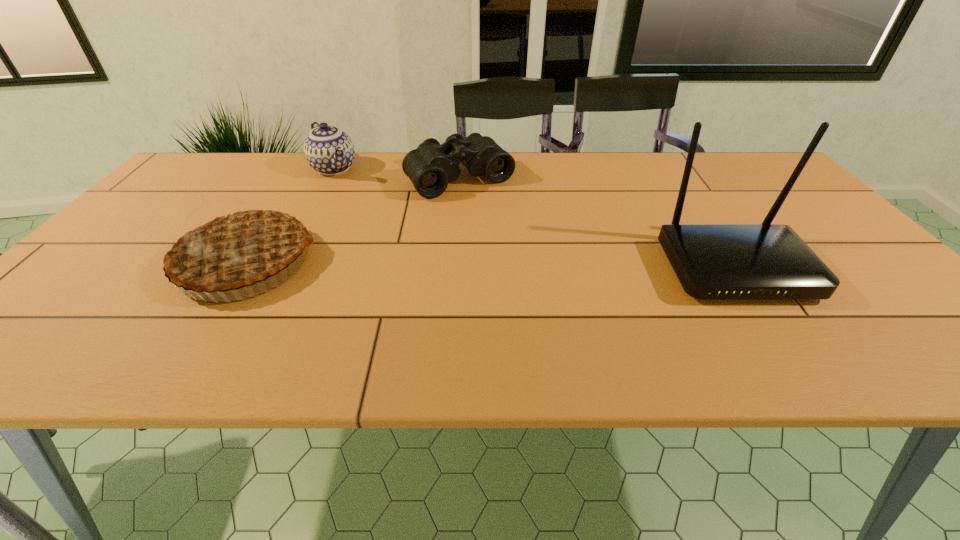
This screenshot has height=540, width=960. I want to click on the third shortest object, so click(234, 245).

Identify the location of the tallest object. (766, 261).

Identify the location of router. (766, 261).

The height and width of the screenshot is (540, 960). In order to click on the shortest object in this screenshot , I will do `click(430, 167)`.

You are a GUI agent. You are given a task and a screenshot of the screen. Output one action in this format:
    pyautogui.click(x=<x>, y=<y>)
    Task: Click on the third object from left to right
    The width and height of the screenshot is (960, 540).
    Given the screenshot: What is the action you would take?
    pyautogui.click(x=430, y=167)

Locate an element on the screen. The height and width of the screenshot is (540, 960). chinaware is located at coordinates (328, 150).

What are the coordinates of `blank space located 0.160m on the left of the pie` in the screenshot? It's located at (110, 262).

I want to click on blank area located on the front-facing side of the router, so click(775, 328).

This screenshot has width=960, height=540. What are the coordinates of `vacant region located at the eyepieces of the shortest object` in the screenshot? It's located at (526, 250).

Find the location of `vacant space located 0.230m at the eyepieces of the shortest object`. vacant space located 0.230m at the eyepieces of the shortest object is located at coordinates (522, 245).